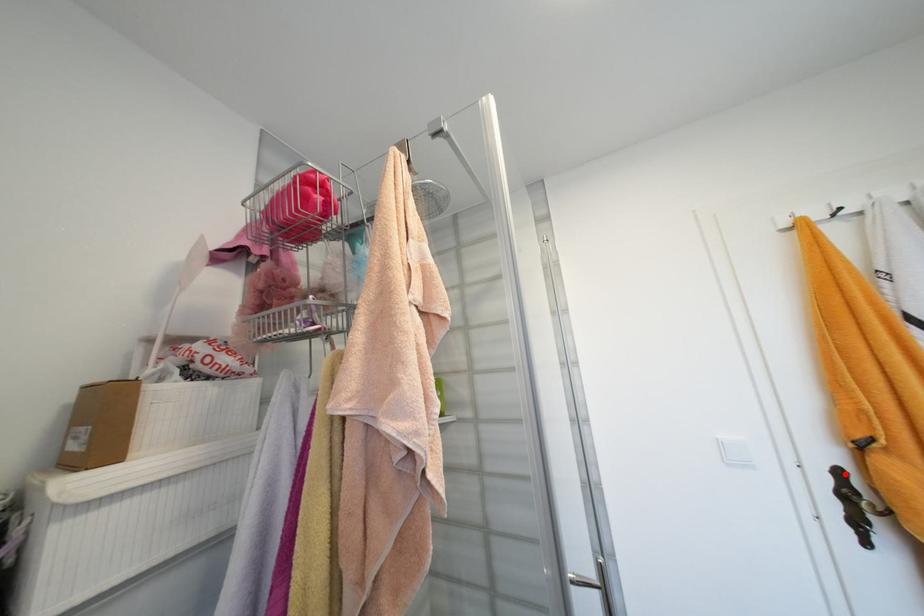
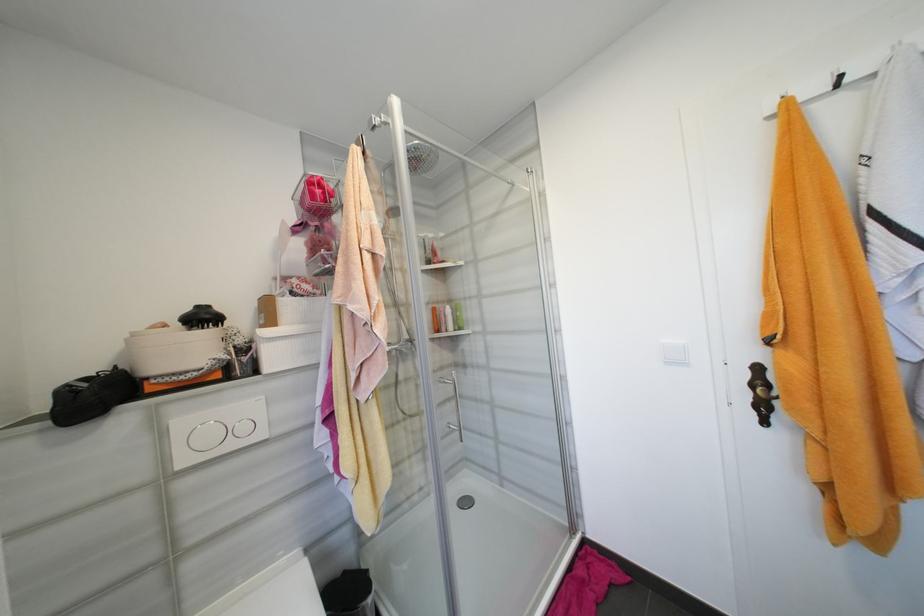
Find the pixel in the second image that matches the highlighted location in the first image.

(763, 370)